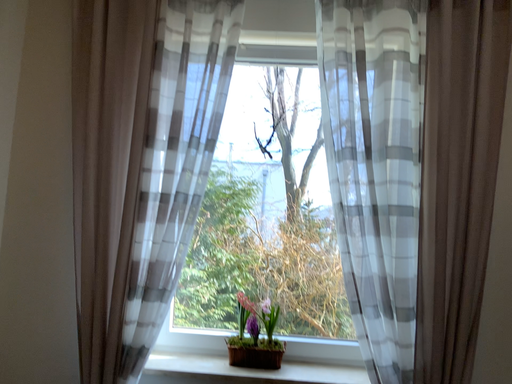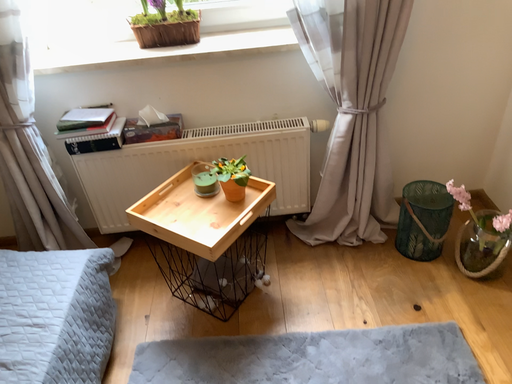
Question: How did the camera likely rotate when shooting the video?

Choices:
 (A) rotated downward
 (B) rotated upward

Answer: (A)